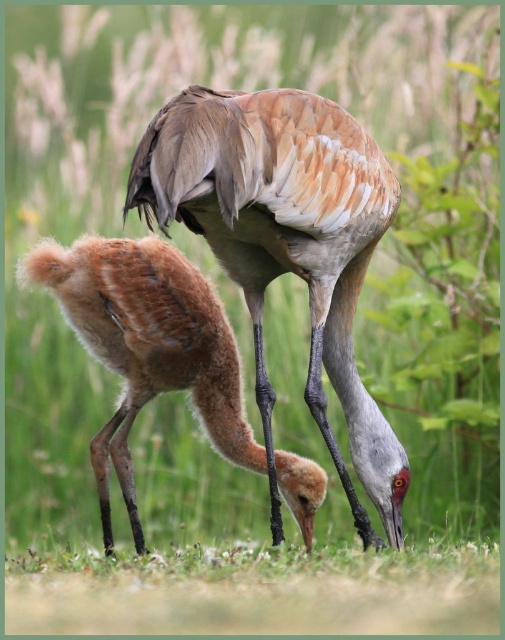
Question: Does brown feathered crane at center lie behind brown fluffy chick at lower left?

Choices:
 (A) no
 (B) yes

Answer: (A)

Question: Considering the relative positions of brown feathered crane at center and brown fluffy chick at lower left in the image provided, where is brown feathered crane at center located with respect to brown fluffy chick at lower left?

Choices:
 (A) left
 (B) right

Answer: (B)

Question: Which point is farther to the camera?

Choices:
 (A) (175, 195)
 (B) (277, 470)

Answer: (B)

Question: Is brown feathered crane at center positioned at the back of brown fluffy chick at lower left?

Choices:
 (A) yes
 (B) no

Answer: (B)